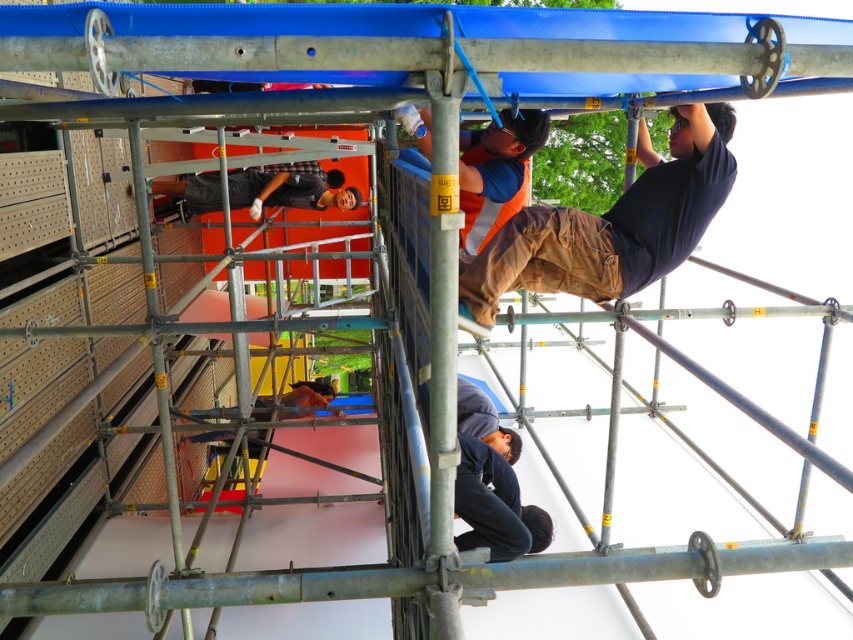
You are a safety inspector looking at the construction site. You notice two orange vests at upper center. Which one is closer to you, the orange safety vest at upper center or the orange reflective vest at upper center?

The orange safety vest at upper center is closer to you because it is in front of the orange reflective vest at upper center.

You are a safety inspector observing the construction scene. You notice two workers at the center of the scaffolding. One is wearing an orange safety vest at upper center, and the other is wearing a matte black shirt at center. From your viewpoint, which worker is positioned more to the right?

The orange safety vest at upper center is to the right of the matte black shirt at center, so the worker in the orange safety vest at upper center is positioned more to the right.

You are a safety inspector standing on the ground floor of a building. You observe two workers on the scaffolding. The first worker is wearing an orange reflective vest at upper center, and the second is wearing a matte black shirt at center. According to safety regulations, the minimum safe distance between workers on the same scaffolding level should be at least 5 meters to prevent accidents. Do these workers comply with the safety regulations?

The distance between the orange reflective vest at upper center and the matte black shirt at center is 4.41 meters, which is less than the required 5 meters. Therefore, the workers are not complying with the safety regulations.